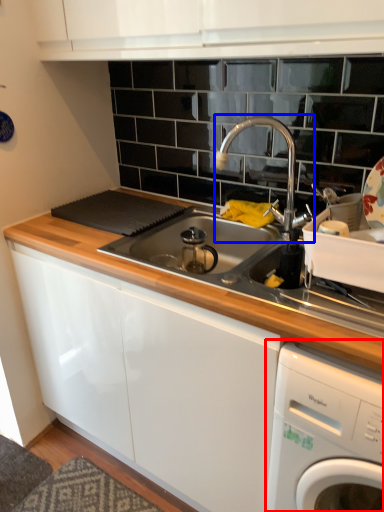
Question: Which of the following is the closest to the observer, home appliance (highlighted by a red box) or tap (highlighted by a blue box)?

Choices:
 (A) home appliance
 (B) tap

Answer: (A)